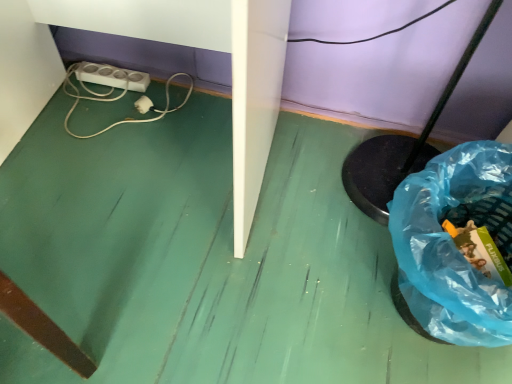
At what (x,y) coordinates should I click in order to perform the action: click on blue plastic bag at lower right. Please return your answer as a coordinate pair (x, y). Image resolution: width=512 pixels, height=384 pixels. Looking at the image, I should click on (451, 246).

In order to face blue plastic bag at lower right, should I rotate leftwards or rightwards?

A 26.405 degree turn to the right will do.

What do you see at coordinates (451, 246) in the screenshot? The image size is (512, 384). I see `blue plastic bag at lower right` at bounding box center [451, 246].

Measure the distance between point (416, 323) and camera.

A distance of 29.09 inches exists between point (416, 323) and camera.

The height and width of the screenshot is (384, 512). In order to click on blue plastic bag at lower right in this screenshot , I will do `click(451, 246)`.